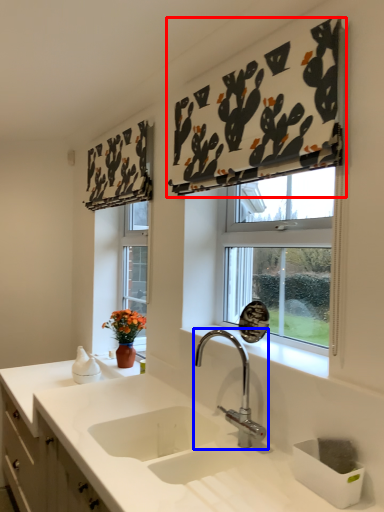
Question: Which point is further to the camera, curtain (highlighted by a red box) or tap (highlighted by a blue box)?

Choices:
 (A) curtain
 (B) tap

Answer: (B)